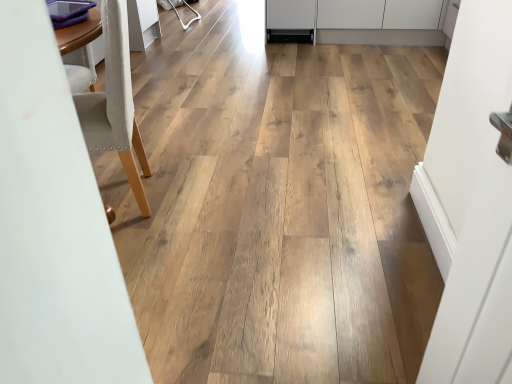
What do you see at coordinates (115, 104) in the screenshot? I see `white fabric chair at left` at bounding box center [115, 104].

What are the coordinates of `white fabric chair at left` in the screenshot? It's located at (115, 104).

Identify the location of white fabric chair at left. Image resolution: width=512 pixels, height=384 pixels. (115, 104).